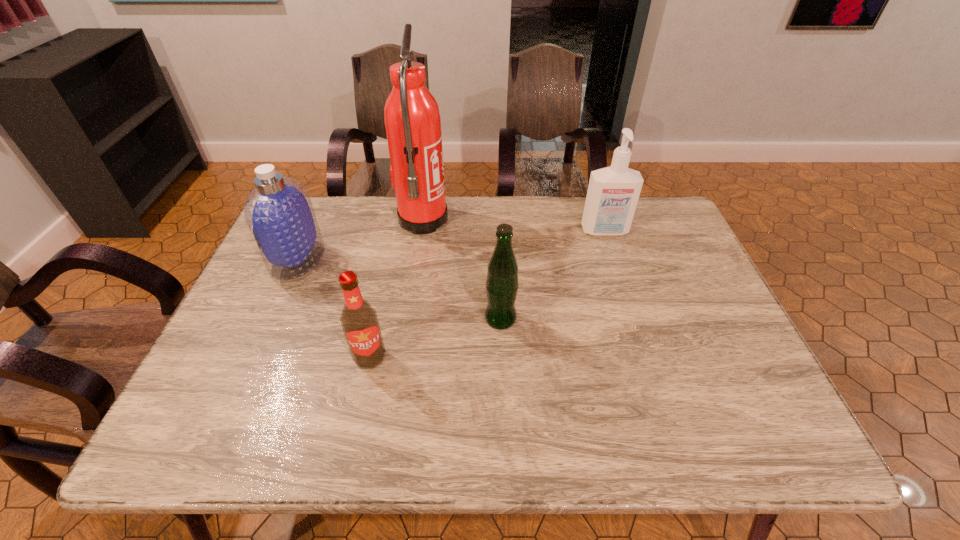
Locate an element on the screen. Image resolution: width=960 pixels, height=540 pixels. object that is the closest to the second object from right to left is located at coordinates (359, 320).

Choose which object is the nearest neighbor to the fourth farthest object. Please provide its 2D coordinates. Your answer should be formatted as a tuple, i.e. [(x, y)], where the tuple contains the x and y coordinates of a point satisfying the conditions above.

[(359, 320)]

This screenshot has width=960, height=540. In order to click on free space in the image that satisfies the following two spatial constraints: 1. on the label side of the second object from right to left; 2. on the left side of the tallest object in this screenshot , I will do `click(407, 319)`.

What are the coordinates of `free location that satisfies the following two spatial constraints: 1. on the label side of the fire extinguisher; 2. on the right side of the farther beer bottle` in the screenshot? It's located at tap(407, 319).